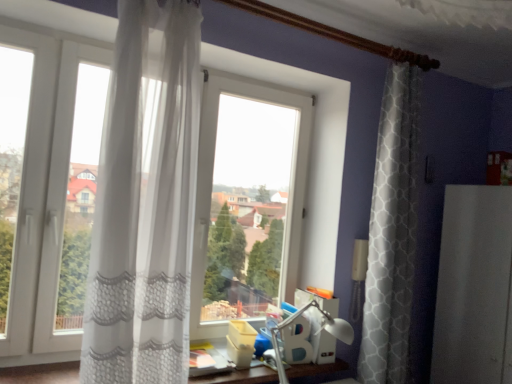
What do you see at coordinates (145, 200) in the screenshot? This screenshot has width=512, height=384. I see `white sheer curtain at left` at bounding box center [145, 200].

You are a GUI agent. You are given a task and a screenshot of the screen. Output one action in this format:
    pyautogui.click(x=<x>, y=<y>)
    Task: Click on the white matte screen door at right
    
    Given the screenshot: What is the action you would take?
    (x=474, y=287)

In order to face white plastic table lamp at center, should I rotate leftwards or rightwards?

To face it directly, rotate right by 7.532 degrees.

At what (x,y) coordinates should I click in order to perform the action: click on white sheer curtain at left. Please return your answer as a coordinate pair (x, y). This screenshot has height=384, width=512. Looking at the image, I should click on (145, 200).

Is white plastic table lamp at center shorter than white sheer curtain at left?

Indeed, white plastic table lamp at center has a lesser height compared to white sheer curtain at left.

Is white plastic table lamp at center positioned far away from white sheer curtain at left?

They are positioned close to each other.

Can you confirm if white sheer curtain at left is thinner than white plastic table lamp at center?

No, white sheer curtain at left is not thinner than white plastic table lamp at center.

Is white sheer curtain at left beside white plastic table lamp at center?

white sheer curtain at left and white plastic table lamp at center are clearly separated.

Find the location of a particular element. The image size is (512, 384). table lamp behind the white sheer curtain at left is located at coordinates (324, 328).

Can you confirm if white sheer curtain at left is smaller than white plastic table lamp at center?

Actually, white sheer curtain at left might be larger than white plastic table lamp at center.

Is white plastic table lamp at center wider than white matte screen door at right?

No.

From the image's perspective, relative to white matte screen door at right, is white plastic table lamp at center above or below?

Based on their image positions, white plastic table lamp at center is located beneath white matte screen door at right.

In the scene shown: Which is more to the left, white plastic table lamp at center or white matte screen door at right?

white plastic table lamp at center is more to the left.

Is white plastic table lamp at center taller or shorter than white matte screen door at right?

In the image, white plastic table lamp at center appears to be shorter than white matte screen door at right.

In the image, is white matte screen door at right positioned in front of or behind white sheer curtain at left?

In the image, white matte screen door at right appears behind white sheer curtain at left.

From a real-world perspective, is white matte screen door at right on top of white sheer curtain at left?

No, from a real-world perspective, white matte screen door at right is not on top of white sheer curtain at left.

Who is shorter, white matte screen door at right or white sheer curtain at left?

white matte screen door at right is shorter.

Between white matte screen door at right and white sheer curtain at left, which one appears on the left side from the viewer's perspective?

Positioned to the left is white sheer curtain at left.

From a real-world perspective, is white sheer curtain at left positioned above or below white matte screen door at right?

From a real-world perspective, white sheer curtain at left is physically above white matte screen door at right.

How different are the orientations of white sheer curtain at left and white matte screen door at right in degrees?

93.4 degrees.

Looking at this image, is white sheer curtain at left positioned far away from white matte screen door at right?

white sheer curtain at left is positioned a significant distance from white matte screen door at right.

From the image's perspective, is white sheer curtain at left on top of white matte screen door at right?

Yes, from the image's perspective, white sheer curtain at left is over white matte screen door at right.

Where is `screen door above the white plastic table lamp at center (from a real-world perspective)`? screen door above the white plastic table lamp at center (from a real-world perspective) is located at coordinates (474, 287).

From the image's perspective, is white matte screen door at right above or below white plastic table lamp at center?

white matte screen door at right is situated higher than white plastic table lamp at center in the image.

Is white matte screen door at right positioned beyond the bounds of white plastic table lamp at center?

Yes, white matte screen door at right is located beyond the bounds of white plastic table lamp at center.

How many degrees apart are the facing directions of white matte screen door at right and white plastic table lamp at center?

The angle between the facing direction of white matte screen door at right and the facing direction of white plastic table lamp at center is 92 degrees.

Find the location of a particular element. The width and height of the screenshot is (512, 384). table lamp below the white sheer curtain at left (from the image's perspective) is located at coordinates (324, 328).

Where is `table lamp behind the white sheer curtain at left`? This screenshot has width=512, height=384. table lamp behind the white sheer curtain at left is located at coordinates (324, 328).

Estimate the real-world distances between objects in this image. Which object is closer to white matte screen door at right, white sheer curtain at left or white plastic table lamp at center?

Among the two, white plastic table lamp at center is located nearer to white matte screen door at right.

Considering their positions, is white plastic table lamp at center positioned closer to white matte screen door at right than white sheer curtain at left?

white plastic table lamp at center is closer to white matte screen door at right.

Which object lies nearer to the anchor point white sheer curtain at left, white plastic table lamp at center or white matte screen door at right?

white plastic table lamp at center is positioned closer to the anchor white sheer curtain at left.

Based on their spatial positions, is white matte screen door at right or white plastic table lamp at center further from white sheer curtain at left?

Based on the image, white matte screen door at right appears to be further to white sheer curtain at left.

Looking at the image, which one is located closer to white plastic table lamp at center, white sheer curtain at left or white matte screen door at right?

white matte screen door at right.

When comparing their distances from white plastic table lamp at center, does white matte screen door at right or white sheer curtain at left seem further?

The object further to white plastic table lamp at center is white sheer curtain at left.

The image size is (512, 384). In order to click on table lamp located between white sheer curtain at left and white matte screen door at right in the left-right direction in this screenshot , I will do `click(324, 328)`.